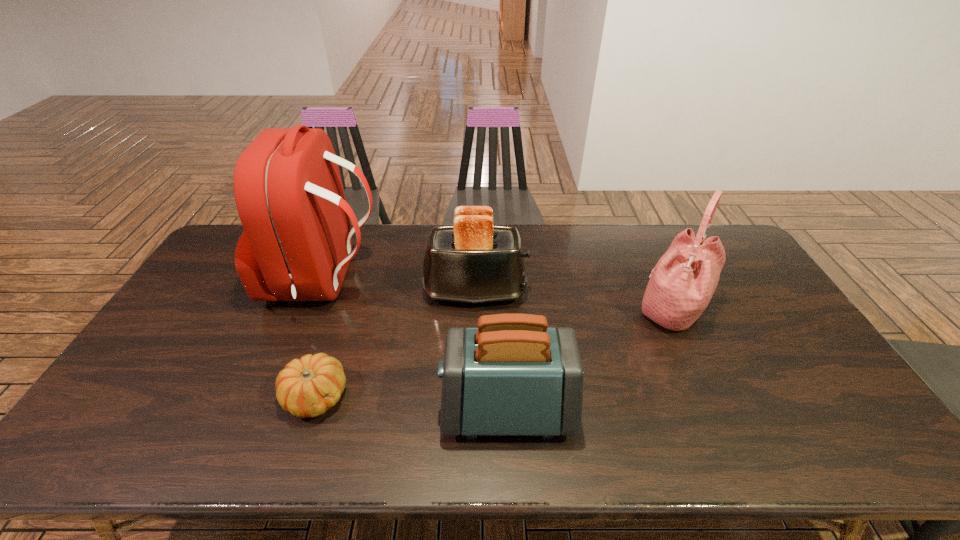
Identify the location of the tallest object. The width and height of the screenshot is (960, 540). (296, 245).

The image size is (960, 540). What are the coordinates of `the second tallest object` in the screenshot? It's located at point(685,278).

Image resolution: width=960 pixels, height=540 pixels. I want to click on the rightmost object, so click(685, 278).

Image resolution: width=960 pixels, height=540 pixels. Find the location of `the farther toaster`. the farther toaster is located at coordinates (473, 261).

Identify the location of the nearer toaster. This screenshot has width=960, height=540. (512, 375).

The height and width of the screenshot is (540, 960). I want to click on gourd, so click(307, 387).

Where is `vacant space located 0.190m on the strap side of the tallest object`? Image resolution: width=960 pixels, height=540 pixels. vacant space located 0.190m on the strap side of the tallest object is located at coordinates (436, 281).

Find the location of a particular element. The height and width of the screenshot is (540, 960). blank space located on the back of the fourth shortest object is located at coordinates (636, 231).

You are a GUI agent. You are given a task and a screenshot of the screen. Output one action in this format:
    pyautogui.click(x=<x>, y=<y>)
    Task: Click on the vacant space situated 0.160m on the side of the farther toaster with the control lever
    
    Given the screenshot: What is the action you would take?
    pyautogui.click(x=578, y=292)

Image resolution: width=960 pixels, height=540 pixels. What are the coordinates of `blank space located on the front-facing side of the nearer toaster` in the screenshot? It's located at (300, 410).